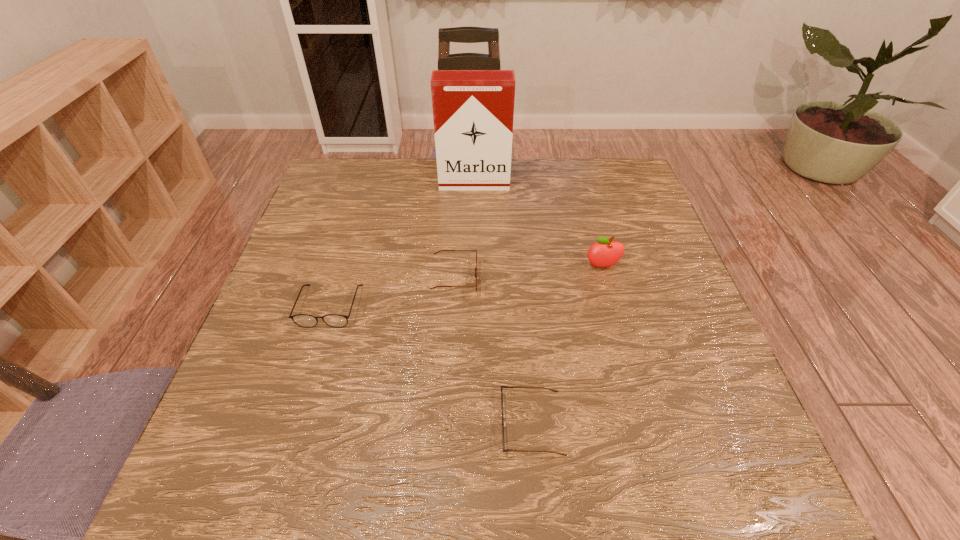
Where is `vacant space at the near edge of the desktop`? This screenshot has width=960, height=540. vacant space at the near edge of the desktop is located at coordinates (611, 454).

Where is `free space at the left edge of the desktop`? This screenshot has width=960, height=540. free space at the left edge of the desktop is located at coordinates (303, 365).

Identify the location of blank space at the right edge of the desktop. pyautogui.click(x=640, y=230).

The image size is (960, 540). Find the location of `vacant region at the far left corner of the desktop`. vacant region at the far left corner of the desktop is located at coordinates (367, 170).

At what (x,y) coordinates should I click in order to perform the action: click on vacant space at the near right corner. Please return your answer as a coordinate pair (x, y). Looking at the image, I should click on (726, 457).

Identify the location of empty space between the cigarette_case and the second spectacles from left to right. The image size is (960, 540). (465, 232).

Locate an element on the screen. vacant space that's between the farthest object and the second spectacles from left to right is located at coordinates (465, 232).

Where is `vacant area between the leftmost object and the farthest object`? This screenshot has width=960, height=540. vacant area between the leftmost object and the farthest object is located at coordinates point(402,245).

Identify the location of free space between the cigarette_case and the leftmost object. (402, 245).

The width and height of the screenshot is (960, 540). I want to click on empty location between the cigarette_case and the nearest spectacles, so click(503, 303).